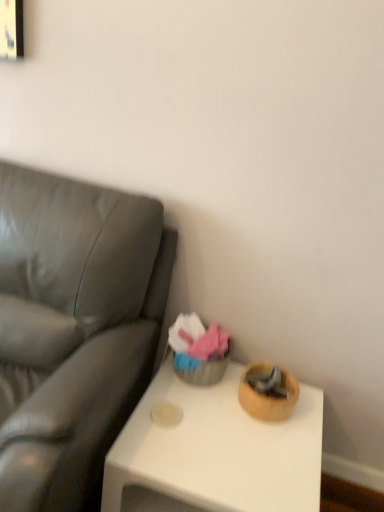
You are a GUI agent. You are given a task and a screenshot of the screen. Output one action in this format:
    pyautogui.click(x=<x>, y=<y>)
    Task: Click on the vacant space situated above wooden bowl at lower right (from a real-world perspective)
    
    Given the screenshot: What is the action you would take?
    pyautogui.click(x=232, y=430)